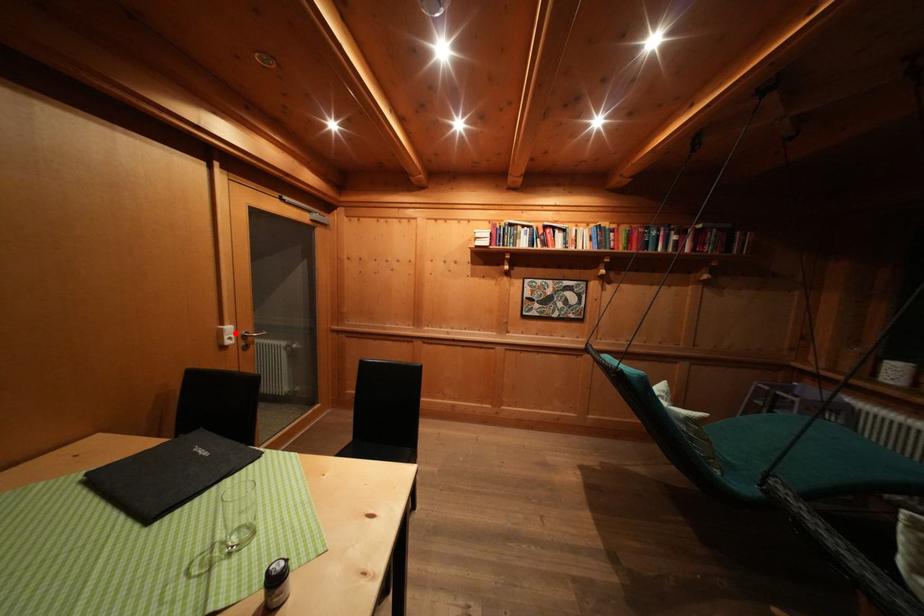
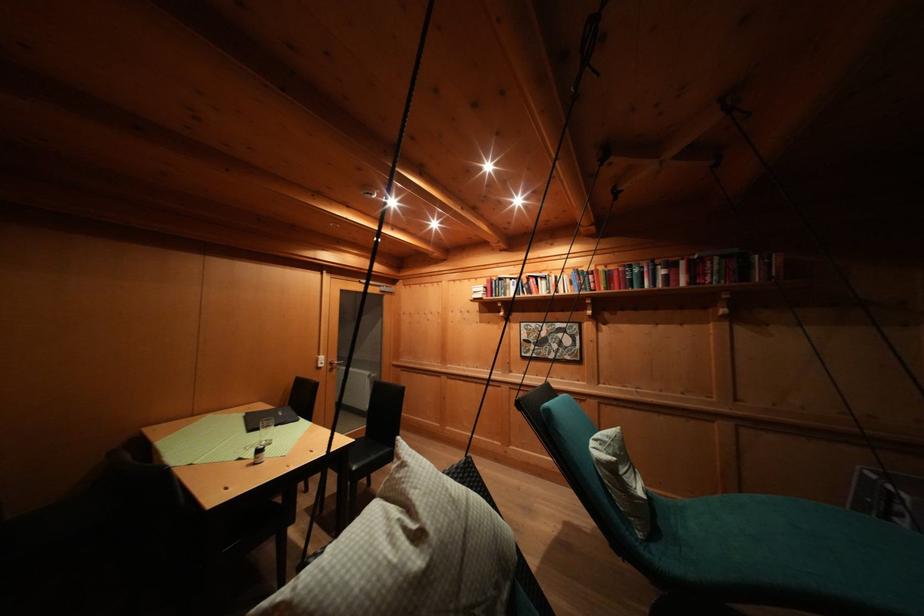
Question: I am providing you with two images of the same scene from different viewpoints. A red point is marked on the first image. Can you still see the location of the red point in image 2?

Choices:
 (A) Yes
 (B) No

Answer: (A)